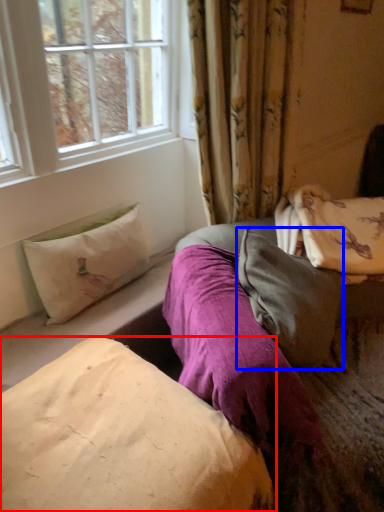
Question: Which point is further to the camera, pillow (highlighted by a red box) or pillow (highlighted by a blue box)?

Choices:
 (A) pillow
 (B) pillow

Answer: (B)